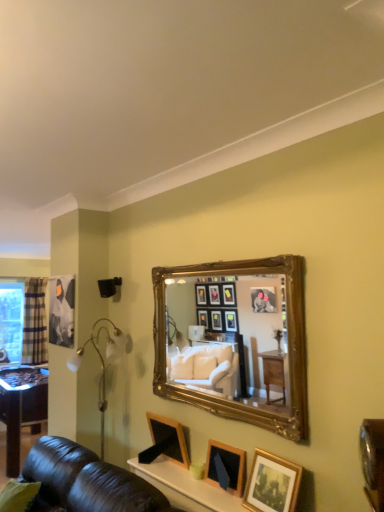
Question: From a real-world perspective, is gold-framed mirror at upper center physically located above or below wooden picture frame at lower center, arranged as the second picture frame when viewed from the right?

Choices:
 (A) above
 (B) below

Answer: (A)

Question: Looking at the image, does gold-framed mirror at upper center seem bigger or smaller compared to wooden picture frame at lower center, the second picture frame positioned from the left?

Choices:
 (A) big
 (B) small

Answer: (A)

Question: Considering the real-world distances, which object is farthest from the clear plastic window screen at left?

Choices:
 (A) plaid fabric curtain at left
 (B) wooden picture frame at lower center, which ranks as the 2th picture frame in front-to-back order
 (C) wooden picture frame at lower center, the first picture frame in the back-to-front sequence
 (D) gold-framed photo at lower right, acting as the third picture frame starting from the left
 (E) gold-framed mirror at upper center

Answer: (D)

Question: Based on their relative distances, which object is nearer to the wooden picture frame at lower center, the second picture frame positioned from the left?

Choices:
 (A) gold-framed photo at lower right, the 1th picture frame positioned from the right
 (B) gold-framed mirror at upper center
 (C) clear plastic window screen at left
 (D) plaid fabric curtain at left
 (E) wooden picture frame at lower center, marked as the 3th picture frame in a right-to-left arrangement

Answer: (A)